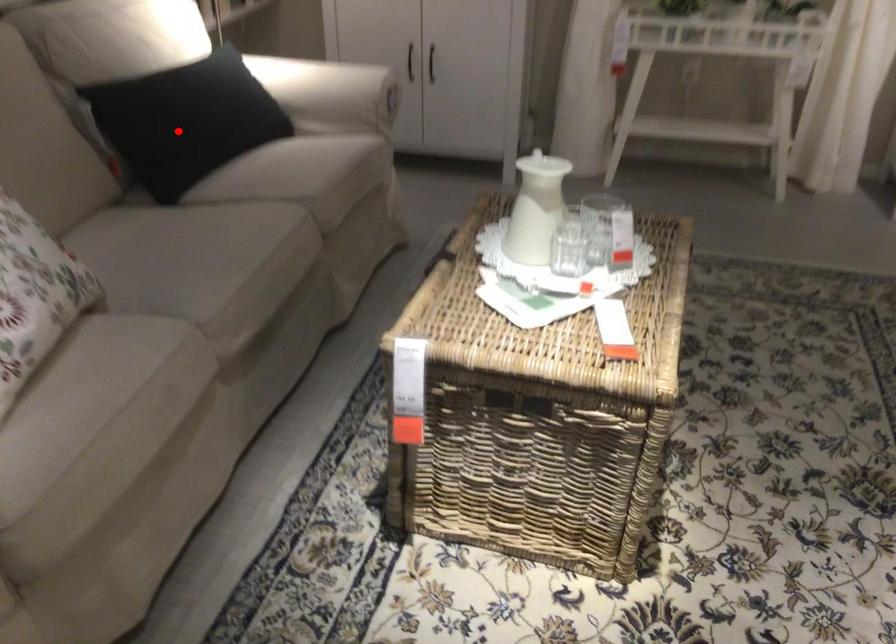
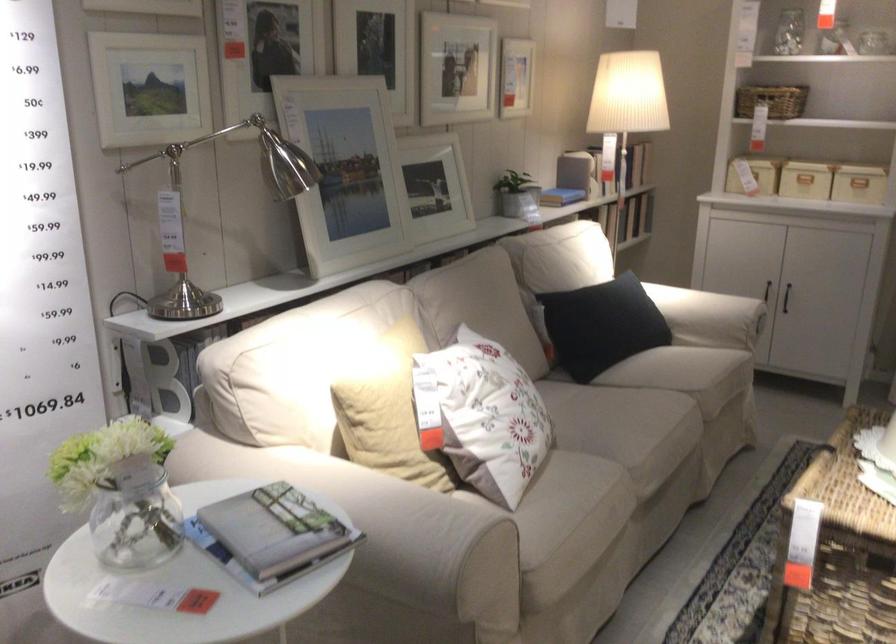
Question: I am providing you with two images of the same scene from different viewpoints. A red point is shown in image1. For the corresponding object point in image2, is it positioned nearer or farther from the camera?

Choices:
 (A) Nearer
 (B) Farther

Answer: (B)